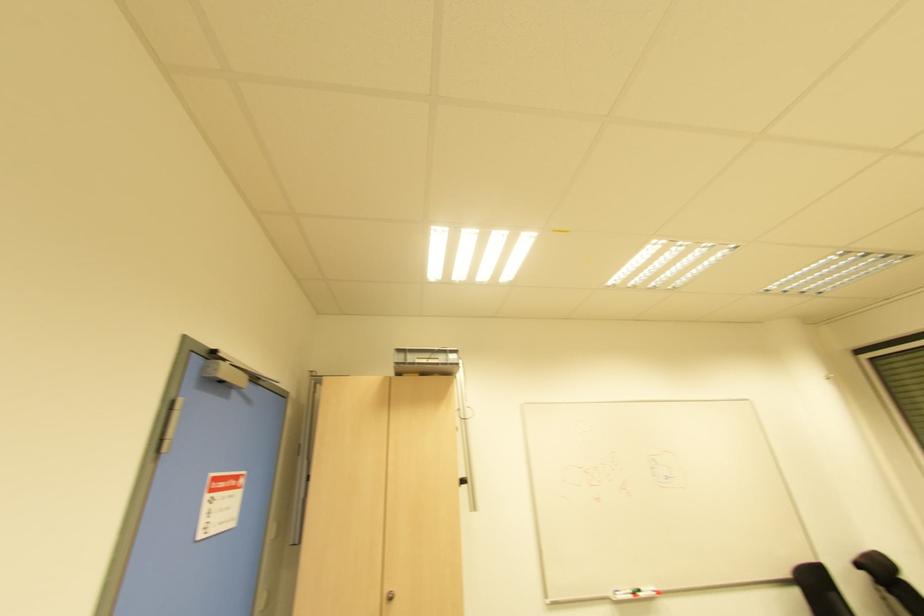
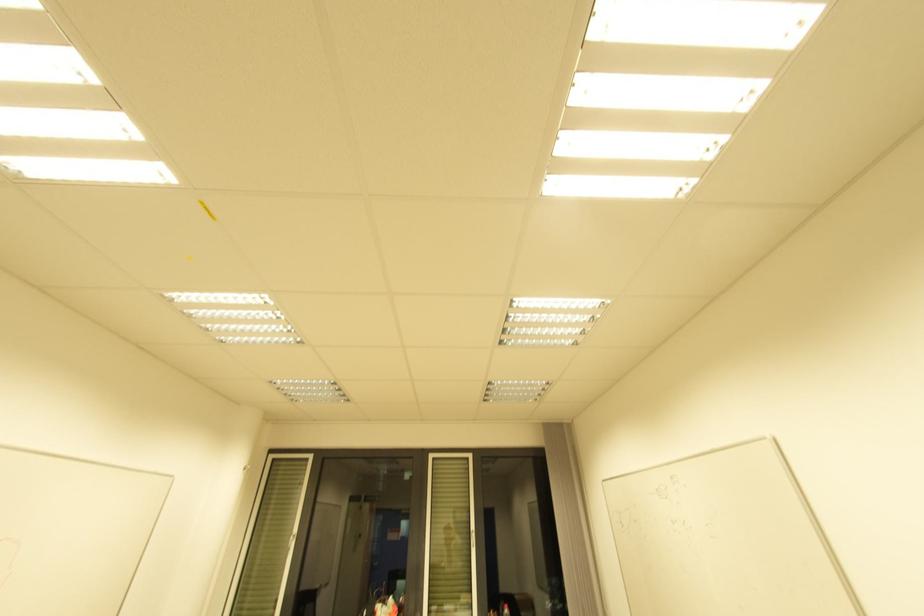
Based on the continuous images, in which direction is the camera rotating?

The rotation direction of the camera is right-up.